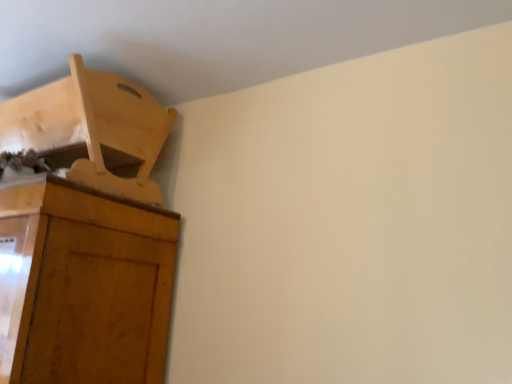
Question: Would you say wooden cupboard at upper left is to the left or to the right of light wood chair at upper left in the picture?

Choices:
 (A) right
 (B) left

Answer: (B)

Question: Considering the positions of wooden cupboard at upper left and light wood chair at upper left in the image, is wooden cupboard at upper left wider or thinner than light wood chair at upper left?

Choices:
 (A) thin
 (B) wide

Answer: (B)

Question: Considering the positions of wooden cupboard at upper left and light wood chair at upper left in the image, is wooden cupboard at upper left taller or shorter than light wood chair at upper left?

Choices:
 (A) tall
 (B) short

Answer: (A)

Question: Relative to wooden cupboard at upper left, is light wood chair at upper left in front or behind?

Choices:
 (A) behind
 (B) front

Answer: (A)

Question: Is point (112, 145) closer or farther from the camera than point (114, 314)?

Choices:
 (A) closer
 (B) farther

Answer: (B)

Question: Is light wood chair at upper left wider or thinner than wooden cupboard at upper left?

Choices:
 (A) thin
 (B) wide

Answer: (A)

Question: From the image's perspective, relative to wooden cupboard at upper left, is light wood chair at upper left above or below?

Choices:
 (A) above
 (B) below

Answer: (A)